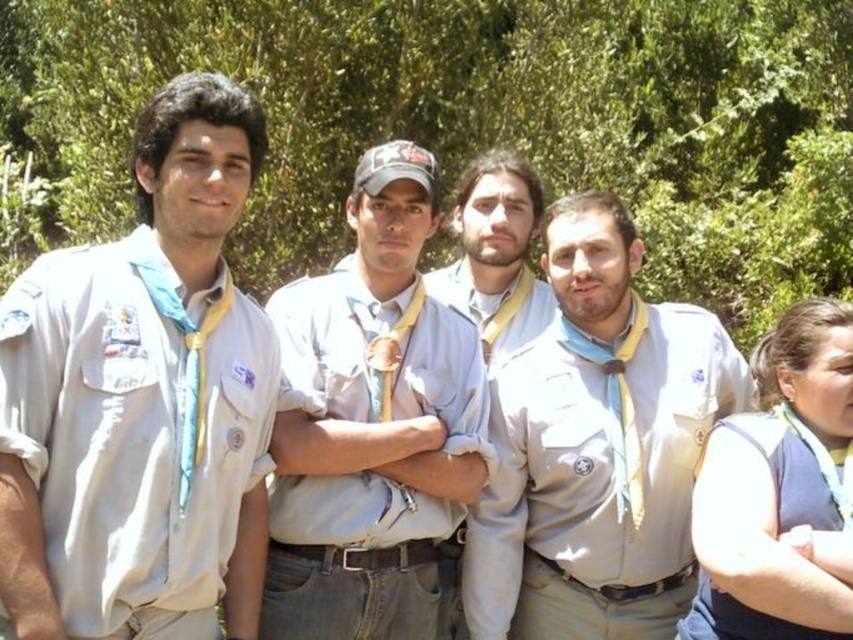
Question: Which object is farther from the camera taking this photo?

Choices:
 (A) matte khaki uniform at center
 (B) light blue fabric at right
 (C) light beige uniform at left

Answer: (A)

Question: Is matte khaki uniform at center above light blue fabric at right?

Choices:
 (A) no
 (B) yes

Answer: (B)

Question: Can you confirm if matte khaki uniform at center is thinner than light beige uniform at center?

Choices:
 (A) yes
 (B) no

Answer: (B)

Question: Where is matte khaki shirt at center located in relation to light beige uniform at center in the image?

Choices:
 (A) left
 (B) right

Answer: (A)

Question: Which of these objects is positioned closest to the light beige uniform at left?

Choices:
 (A) light beige uniform at center
 (B) matte khaki shirt at center
 (C) matte khaki uniform at center

Answer: (B)

Question: Which of the following is the closest to the observer?

Choices:
 (A) (494, 598)
 (B) (844, 476)
 (C) (479, 172)
 (D) (154, 282)

Answer: (D)